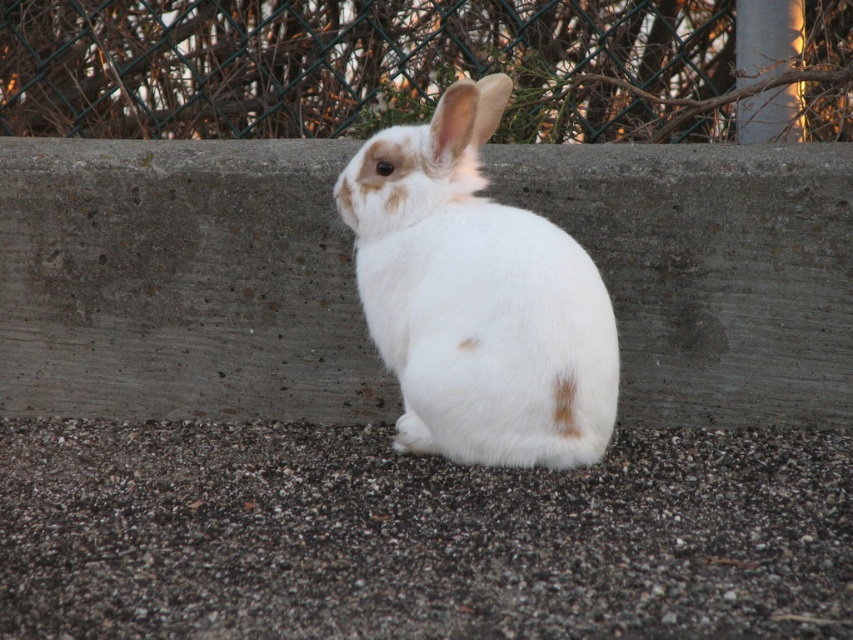
You are standing in a garden and see the point at coordinates (180, 282). What is located at that point?

The gray concrete at center is located at point (180, 282).

You are standing in a garden and see the gray concrete at center. If you want to place a 10 foot long garden hose on the ground in front of you, will it fit entirely within your view?

The gray concrete at center is 9.85 feet from viewer. Since the garden hose is 10 feet long, it will extend slightly beyond the gray concrete at center, meaning part of it might be out of the immediate view.